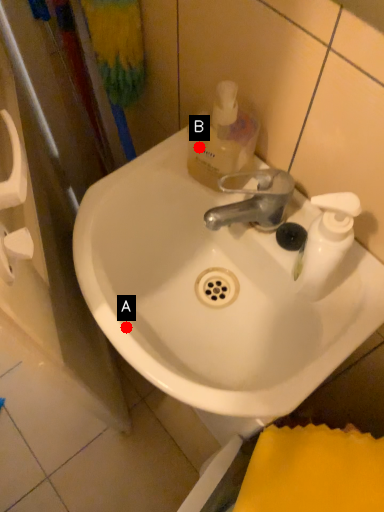
Question: Two points are circled on the image, labeled by A and B beside each circle. Among these points, which one is nearest to the camera?

Choices:
 (A) A is closer
 (B) B is closer

Answer: (A)